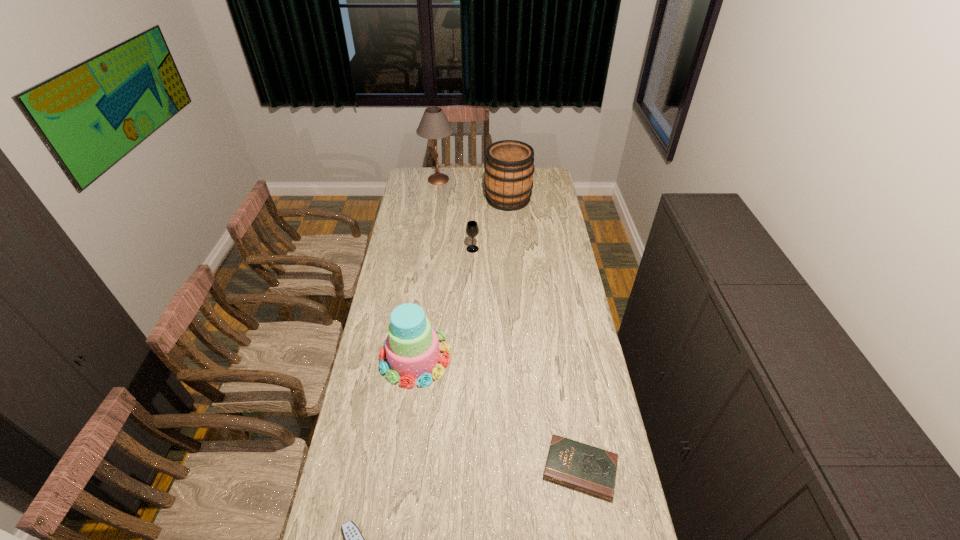
This screenshot has width=960, height=540. In order to click on vacant point located between the tallest object and the second tallest object in this screenshot , I will do `click(473, 189)`.

Locate an element on the screen. The height and width of the screenshot is (540, 960). object identified as the second closest to the fifth shortest object is located at coordinates (472, 229).

Locate which object ranks fourth in proximity to the Bible. Please provide its 2D coordinates. Your answer should be formatted as a tuple, i.e. [(x, y)], where the tuple contains the x and y coordinates of a point satisfying the conditions above.

[(509, 168)]

At what (x,y) coordinates should I click in order to perform the action: click on free location that satisfies the following two spatial constraints: 1. on the back side of the cider; 2. on the left side of the cake. Please return your answer as a coordinate pair (x, y). The height and width of the screenshot is (540, 960). Looking at the image, I should click on (436, 199).

Find the location of a particular element. This screenshot has height=540, width=960. vacant area that satisfies the following two spatial constraints: 1. on the front-facing side of the table lamp; 2. on the right side of the fifth shortest object is located at coordinates (436, 199).

Where is `vacant space that satisfies the following two spatial constraints: 1. on the back side of the fifth tallest object; 2. on the front-facing side of the tallest object`? The height and width of the screenshot is (540, 960). vacant space that satisfies the following two spatial constraints: 1. on the back side of the fifth tallest object; 2. on the front-facing side of the tallest object is located at coordinates (532, 179).

The image size is (960, 540). I want to click on vacant space that satisfies the following two spatial constraints: 1. on the front-facing side of the tallest object; 2. on the right side of the Bible, so click(400, 469).

You are a GUI agent. You are given a task and a screenshot of the screen. Output one action in this format:
    pyautogui.click(x=<x>, y=<y>)
    Task: Click on the free space that satisfies the following two spatial constraints: 1. on the front-facing side of the second tallest object; 2. on the right side of the table lamp
    The height and width of the screenshot is (540, 960).
    Given the screenshot: What is the action you would take?
    pyautogui.click(x=436, y=199)

Identify the location of vacant space that satisfies the following two spatial constraints: 1. on the back side of the second shortest object; 2. on the front-facing side of the table lamp. The image size is (960, 540). (532, 179).